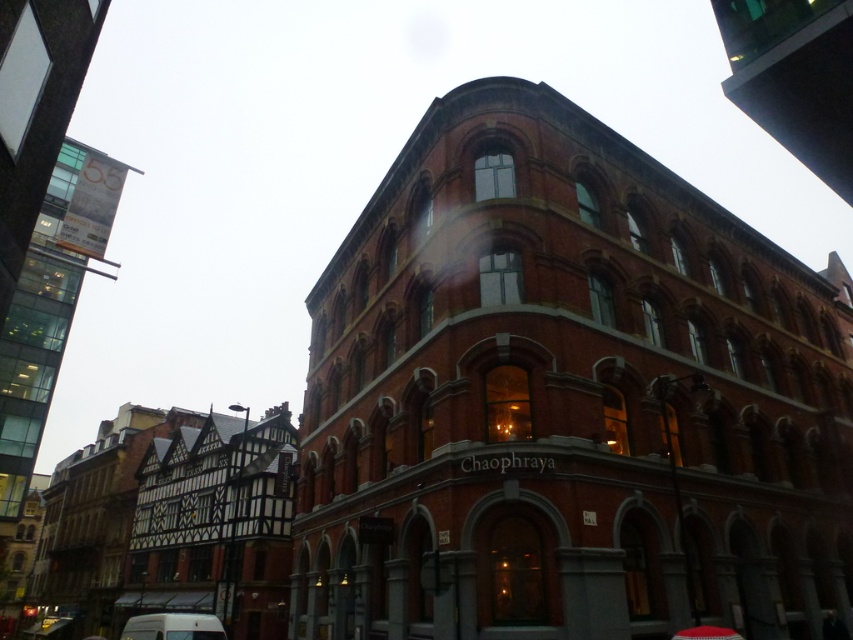
Question: Is red brick building at center thinner than white matte van at lower left?

Choices:
 (A) no
 (B) yes

Answer: (A)

Question: Which point is farther to the camera?

Choices:
 (A) (169, 637)
 (B) (552, 632)

Answer: (A)

Question: Among these objects, which one is farthest from the camera?

Choices:
 (A) red brick building at center
 (B) white matte van at lower left

Answer: (B)

Question: Does red brick building at center appear over white matte van at lower left?

Choices:
 (A) yes
 (B) no

Answer: (A)

Question: Which point is farther from the camera taking this photo?

Choices:
 (A) (160, 632)
 (B) (732, 444)

Answer: (B)

Question: Considering the relative positions of red brick building at center and white matte van at lower left in the image provided, where is red brick building at center located with respect to white matte van at lower left?

Choices:
 (A) below
 (B) above

Answer: (B)